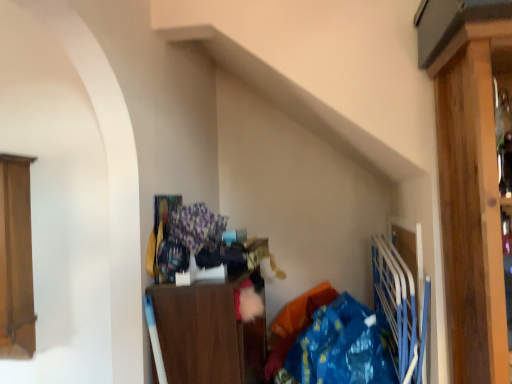
This screenshot has width=512, height=384. What do you see at coordinates (16, 259) in the screenshot?
I see `wooden cabinet at left, which ranks as the 1th cabinetry in left-to-right order` at bounding box center [16, 259].

I want to click on wooden cabinet at left, which ranks as the 1th cabinetry in left-to-right order, so click(x=16, y=259).

How much space does wooden cabinet at center, which ranks as the first cabinetry in right-to-left order, occupy vertically?

wooden cabinet at center, which ranks as the first cabinetry in right-to-left order, is 22.30 inches tall.

Find the location of a particular element. wooden cabinet at left, which ranks as the 1th cabinetry in left-to-right order is located at coordinates (16, 259).

Consider the image. From their relative heights in the image, would you say blue plastic bag at lower right is taller or shorter than wooden cabinet at left, which ranks as the 1th cabinetry in left-to-right order?

Clearly, blue plastic bag at lower right is shorter compared to wooden cabinet at left, which ranks as the 1th cabinetry in left-to-right order.

Between blue plastic bag at lower right and wooden cabinet at left, positioned as the second cabinetry in right-to-left order, which one is positioned behind?

wooden cabinet at left, positioned as the second cabinetry in right-to-left order.

Can you tell me how much blue plastic bag at lower right and wooden cabinet at left, positioned as the second cabinetry in right-to-left order, differ in facing direction?

blue plastic bag at lower right and wooden cabinet at left, positioned as the second cabinetry in right-to-left order, are facing 2.76 degrees away from each other.

Does blue plastic bag at lower right turn towards wooden cabinet at left, which ranks as the 1th cabinetry in left-to-right order?

No, blue plastic bag at lower right is not turned towards wooden cabinet at left, which ranks as the 1th cabinetry in left-to-right order.

Considering the positions of objects wooden cabinet at center, arranged as the 2th cabinetry when viewed from the left, and wooden cabinet at left, which ranks as the 1th cabinetry in left-to-right order, in the image provided, who is in front, wooden cabinet at center, arranged as the 2th cabinetry when viewed from the left, or wooden cabinet at left, which ranks as the 1th cabinetry in left-to-right order,?

wooden cabinet at center, arranged as the 2th cabinetry when viewed from the left, is closer to the camera.

Based on the photo, how many degrees apart are the facing directions of wooden cabinet at center, which ranks as the first cabinetry in right-to-left order, and wooden cabinet at left, which ranks as the 1th cabinetry in left-to-right order?

They differ by 91.2 degrees in their facing directions.

Based on the photo, between wooden cabinet at center, which ranks as the first cabinetry in right-to-left order, and wooden cabinet at left, which ranks as the 1th cabinetry in left-to-right order, which one has larger width?

wooden cabinet at center, which ranks as the first cabinetry in right-to-left order, is wider.

Is wooden cabinet at center, which ranks as the first cabinetry in right-to-left order, positioned with its back to wooden cabinet at left, positioned as the second cabinetry in right-to-left order?

Yes, wooden cabinet at center, which ranks as the first cabinetry in right-to-left order, is positioned with its back facing wooden cabinet at left, positioned as the second cabinetry in right-to-left order.

Between wooden cabinet at center, which ranks as the first cabinetry in right-to-left order, and blue plastic bag at lower right, which one has smaller size?

Smaller between the two is blue plastic bag at lower right.

Would you say wooden cabinet at center, arranged as the 2th cabinetry when viewed from the left, contains blue plastic bag at lower right?

No, wooden cabinet at center, arranged as the 2th cabinetry when viewed from the left, does not contain blue plastic bag at lower right.

Considering the relative sizes of wooden cabinet at center, which ranks as the first cabinetry in right-to-left order, and blue plastic bag at lower right in the image provided, is wooden cabinet at center, which ranks as the first cabinetry in right-to-left order, shorter than blue plastic bag at lower right?

Incorrect, the height of wooden cabinet at center, which ranks as the first cabinetry in right-to-left order, does not fall short of that of blue plastic bag at lower right.

From the image's perspective, is blue plastic bag at lower right above wooden cabinet at center, which ranks as the first cabinetry in right-to-left order?

No.

Who is shorter, blue plastic bag at lower right or wooden cabinet at center, arranged as the 2th cabinetry when viewed from the left?

blue plastic bag at lower right.

From a real-world perspective, which is physically above, blue plastic bag at lower right or wooden cabinet at center, arranged as the 2th cabinetry when viewed from the left?

wooden cabinet at center, arranged as the 2th cabinetry when viewed from the left, is physically above.

Does wooden cabinet at left, which ranks as the 1th cabinetry in left-to-right order, have a greater height compared to wooden cabinet at center, which ranks as the first cabinetry in right-to-left order?

Yes.

From a real-world perspective, which object rests below the other?

wooden cabinet at center, which ranks as the first cabinetry in right-to-left order, from a real-world perspective.

In the image, is wooden cabinet at left, which ranks as the 1th cabinetry in left-to-right order, positioned in front of or behind wooden cabinet at center, which ranks as the first cabinetry in right-to-left order?

wooden cabinet at left, which ranks as the 1th cabinetry in left-to-right order, is positioned farther from the viewer than wooden cabinet at center, which ranks as the first cabinetry in right-to-left order.

Between wooden cabinet at left, positioned as the second cabinetry in right-to-left order, and wooden cabinet at center, arranged as the 2th cabinetry when viewed from the left, which one has smaller size?

wooden cabinet at left, positioned as the second cabinetry in right-to-left order.

Is the surface of wooden cabinet at left, positioned as the second cabinetry in right-to-left order, in direct contact with blue plastic bag at lower right?

No, wooden cabinet at left, positioned as the second cabinetry in right-to-left order, is not making contact with blue plastic bag at lower right.

Choose the correct answer: Is wooden cabinet at left, which ranks as the 1th cabinetry in left-to-right order, inside blue plastic bag at lower right or outside it?

wooden cabinet at left, which ranks as the 1th cabinetry in left-to-right order, lies outside blue plastic bag at lower right.

Considering the relative sizes of wooden cabinet at left, positioned as the second cabinetry in right-to-left order, and blue plastic bag at lower right in the image provided, is wooden cabinet at left, positioned as the second cabinetry in right-to-left order, wider than blue plastic bag at lower right?

Incorrect, the width of wooden cabinet at left, positioned as the second cabinetry in right-to-left order, does not surpass that of blue plastic bag at lower right.

Considering the sizes of objects wooden cabinet at left, which ranks as the 1th cabinetry in left-to-right order, and blue plastic bag at lower right in the image provided, who is bigger, wooden cabinet at left, which ranks as the 1th cabinetry in left-to-right order, or blue plastic bag at lower right?

blue plastic bag at lower right is bigger.

Image resolution: width=512 pixels, height=384 pixels. In the image, there is a wooden cabinet at left, positioned as the second cabinetry in right-to-left order. In order to click on clothing below it (from the image's perspective) in this screenshot , I will do `click(343, 346)`.

At what (x,y) coordinates should I click in order to perform the action: click on cabinetry on the right side of wooden cabinet at left, which ranks as the 1th cabinetry in left-to-right order. Please return your answer as a coordinate pair (x, y). The width and height of the screenshot is (512, 384). Looking at the image, I should click on (199, 330).

From the picture: Which object lies further to the anchor point wooden cabinet at center, arranged as the 2th cabinetry when viewed from the left, wooden cabinet at left, which ranks as the 1th cabinetry in left-to-right order, or blue plastic bag at lower right?

wooden cabinet at left, which ranks as the 1th cabinetry in left-to-right order.

From the image, which object appears to be farther from wooden cabinet at center, which ranks as the first cabinetry in right-to-left order, blue plastic bag at lower right or wooden cabinet at left, which ranks as the 1th cabinetry in left-to-right order?

The object further to wooden cabinet at center, which ranks as the first cabinetry in right-to-left order, is wooden cabinet at left, which ranks as the 1th cabinetry in left-to-right order.

Estimate the real-world distances between objects in this image. Which object is closer to blue plastic bag at lower right, wooden cabinet at left, positioned as the second cabinetry in right-to-left order, or wooden cabinet at center, which ranks as the first cabinetry in right-to-left order?

wooden cabinet at center, which ranks as the first cabinetry in right-to-left order, lies closer to blue plastic bag at lower right than the other object.

When comparing their distances from wooden cabinet at left, positioned as the second cabinetry in right-to-left order, does wooden cabinet at center, which ranks as the first cabinetry in right-to-left order, or blue plastic bag at lower right seem closer?

wooden cabinet at center, which ranks as the first cabinetry in right-to-left order, is positioned closer to the anchor wooden cabinet at left, positioned as the second cabinetry in right-to-left order.

Considering their positions, is wooden cabinet at center, which ranks as the first cabinetry in right-to-left order, positioned closer to blue plastic bag at lower right than wooden cabinet at left, which ranks as the 1th cabinetry in left-to-right order?

wooden cabinet at center, which ranks as the first cabinetry in right-to-left order.

Looking at the image, which one is located closer to wooden cabinet at left, positioned as the second cabinetry in right-to-left order, blue plastic bag at lower right or wooden cabinet at center, arranged as the 2th cabinetry when viewed from the left?

The object closer to wooden cabinet at left, positioned as the second cabinetry in right-to-left order, is wooden cabinet at center, arranged as the 2th cabinetry when viewed from the left.

Find the location of a particular element. The width and height of the screenshot is (512, 384). cabinetry located between wooden cabinet at left, which ranks as the 1th cabinetry in left-to-right order, and blue plastic bag at lower right in the left-right direction is located at coordinates (199, 330).